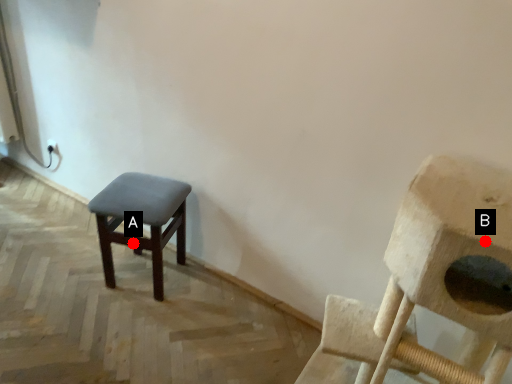
Question: Two points are circled on the image, labeled by A and B beside each circle. Which point appears farthest from the camera in this image?

Choices:
 (A) A is further
 (B) B is further

Answer: (A)